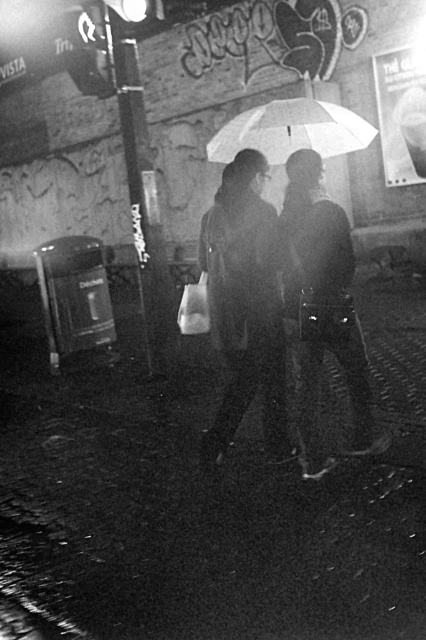
From the picture: You are a photographer trying to capture the two figures under the umbrellas in this night scene. Which umbrella is closer to the camera, the matte black umbrella at center or the white matte umbrella at upper center?

The matte black umbrella at center is closer to the camera since it is positioned in front of the white matte umbrella at upper center.

You are a photographer analyzing the composition of this black and white night scene. You notice two umbrellas in the image. Which one is positioned to the left of the other? The umbrellas are the matte black umbrella at center and the white matte umbrella at upper center.

The matte black umbrella at center is positioned to the left of the white matte umbrella at upper center.